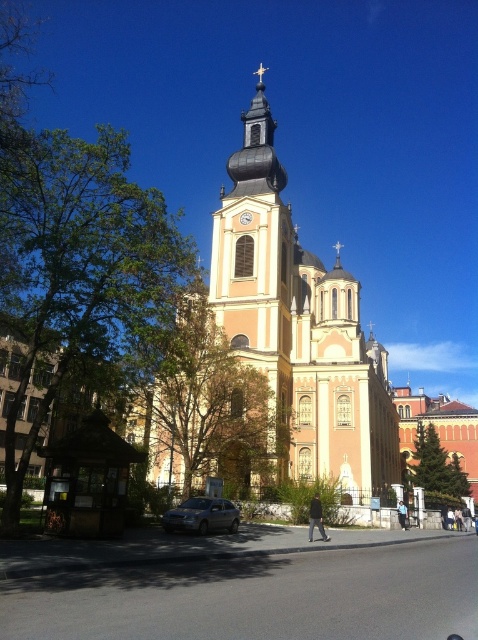
Question: Can you confirm if pink stone church at center is positioned to the right of matte red clock at center?

Choices:
 (A) yes
 (B) no

Answer: (A)

Question: Is pink stone church at center thinner than matte red clock at center?

Choices:
 (A) yes
 (B) no

Answer: (B)

Question: Among these points, which one is farthest from the camera?

Choices:
 (A) (206, 509)
 (B) (346, 460)
 (C) (250, 216)

Answer: (C)

Question: Which of these objects is positioned farthest from the matte red clock at center?

Choices:
 (A) satin silver sedan at lower center
 (B) pink stone church at center

Answer: (A)

Question: Which of these objects is positioned farthest from the matte red clock at center?

Choices:
 (A) pink stone church at center
 (B) satin silver sedan at lower center

Answer: (B)

Question: Can you confirm if satin silver sedan at lower center is positioned to the left of matte red clock at center?

Choices:
 (A) yes
 (B) no

Answer: (A)